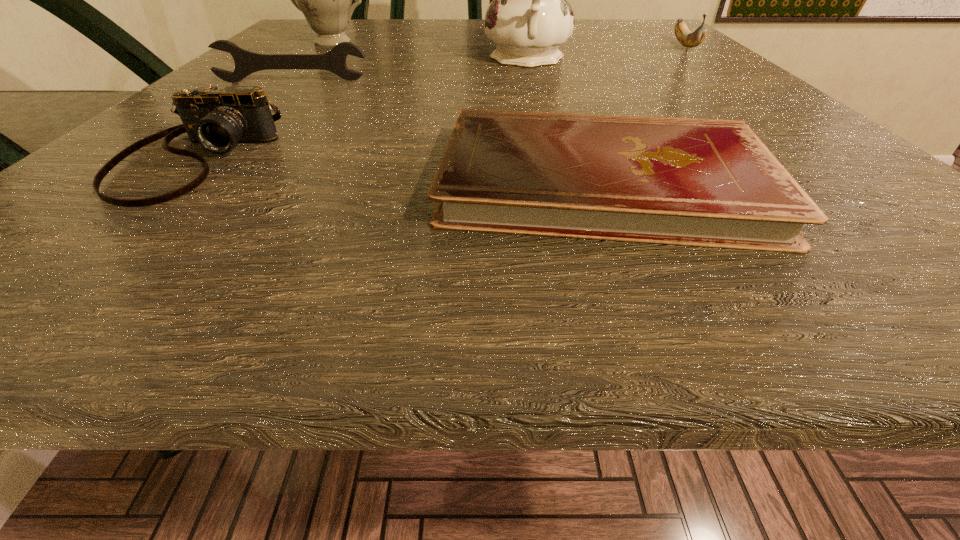
At what (x,y) coordinates should I click in order to perform the action: click on the tallest object. Please return your answer as a coordinate pair (x, y). Image resolution: width=960 pixels, height=540 pixels. Looking at the image, I should click on (529, 18).

Locate an element on the screen. the taller chinaware is located at coordinates (529, 18).

Identify the location of the left chinaware. (325, 0).

This screenshot has width=960, height=540. Identify the location of the second tallest object. (325, 0).

This screenshot has height=540, width=960. In order to click on the rightmost object in this screenshot , I will do `click(689, 39)`.

Where is `the fourth farthest object`? Image resolution: width=960 pixels, height=540 pixels. the fourth farthest object is located at coordinates (246, 62).

Image resolution: width=960 pixels, height=540 pixels. I want to click on camera, so click(x=217, y=119).

Identify the location of the shortest object. (713, 183).

Find the location of a particular element. The height and width of the screenshot is (540, 960). free spot located on the left of the tallest object is located at coordinates (334, 59).

Locate an element on the screen. The width and height of the screenshot is (960, 540). vacant space located on the spout of the shorter chinaware is located at coordinates (294, 80).